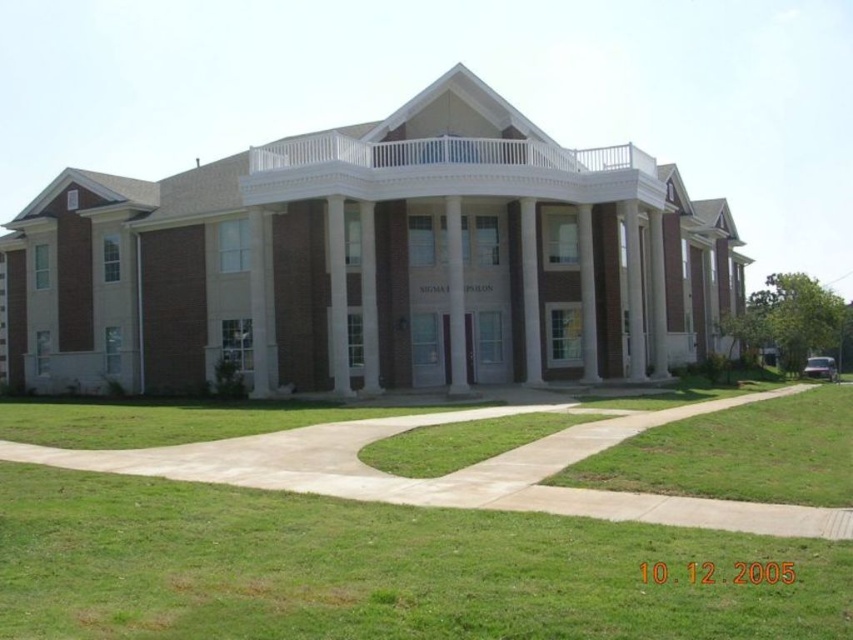
You are standing at a distance from the brown brick building at center. If you want to take a photo that captures the entire building without any cropping, what is the minimum distance you should maintain from the building?

The brown brick building at center is 23.87 meters from the viewer, so to capture the entire building in the photo without cropping, you should maintain a distance of at least 23.87 meters from the building.

You are standing in front of the building and notice two points marked on the facade. The first point is at coordinates point (793,445) and the second is at point (572,168). Which of these points is closer to your current position?

Point (793,445) is closer to the camera than point (572,168), so the first point is closer to your current position.

You are standing at the entrance of the building and looking towards the central pediment. There are two points marked on the facade at coordinates point (207, 198) and point (450, 349). Which point is closer to you?

Point (450, 349) is closer to you because it is in front of point (207, 198).